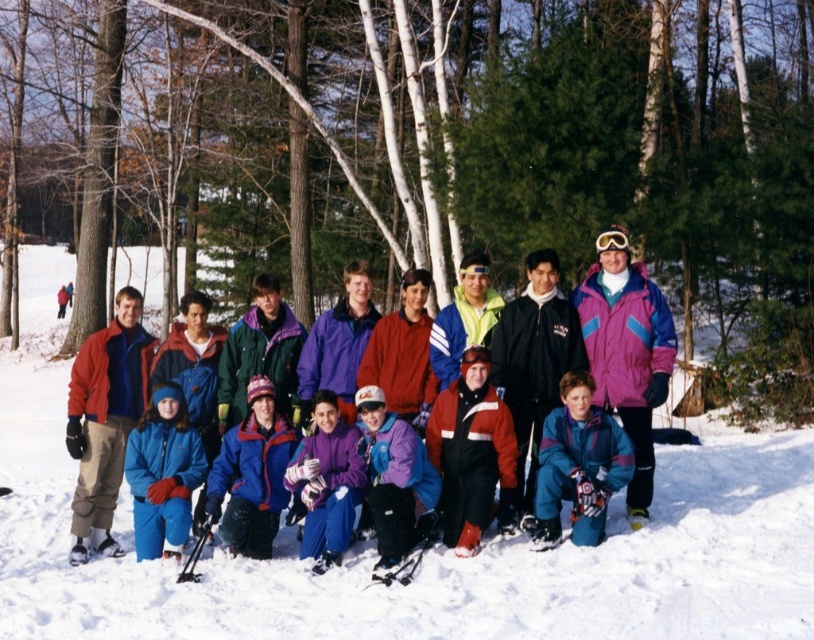
You are standing in the snowy scene and want to take a photo of the group. You notice two jackets in the center area. Which jacket is positioned to the right of the other? The matte purple ski jacket at center or the matte red jacket at center?

The matte purple ski jacket at center is positioned to the right of the matte red jacket at center.

In the scene shown: You are standing at the origin point in the image and want to locate the blue fleece jacket at lower left. Which direction should you move to find it?

The blue fleece jacket at lower left is located at point 0.742 on the x axis and 0.201 on the y axis. Since the origin is at the bottom left corner, you should move to the right along the x axis and slightly up along the y axis to reach it.